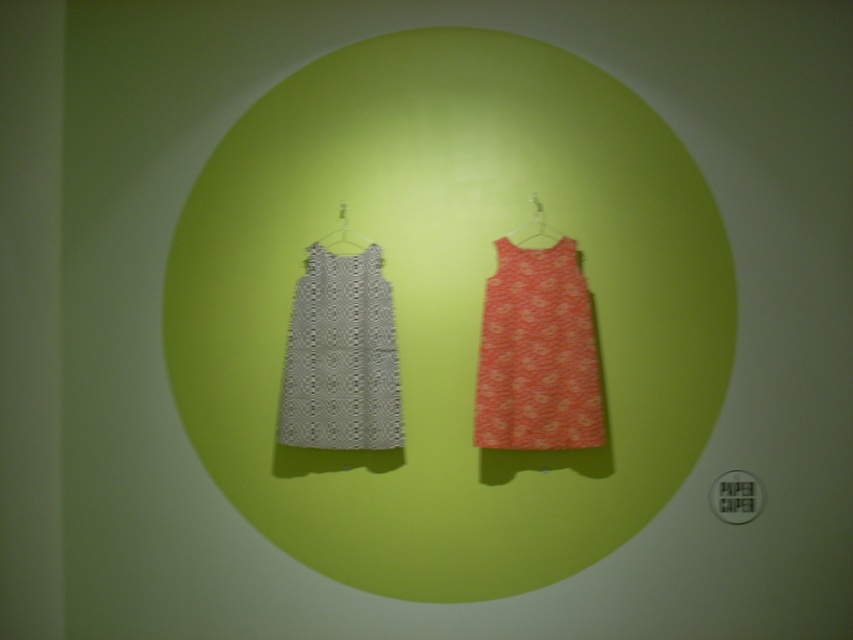
You are a fashion designer observing the image of two dresses. You need to determine which object is taller between the matte orange dress at center and the metallic silver hanger at upper center. Based on the scene, which one is taller?

The matte orange dress at center has a greater height compared to the metallic silver hanger at upper center, so the matte orange dress at center is taller.

You are standing 7 feet away from a display of dresses. You want to grab the matte orange dress at center without moving closer. Is it possible to reach it from your current position?

The matte orange dress at center is 6.95 feet away from the viewer. Since you are standing 7 feet away, you can just barely reach it without moving closer.

You are standing in front of the two dresses displayed against the green background. The point at coordinates (567, 342) is 7.03 feet away from you. If you want to reach that point, which dress should you move toward?

The point at coordinates (567, 342) is 7.03 feet away from the viewer. Since the point is equidistant to both dresses, you can move toward either the black and white geometric patterned dress on the left or the vibrant orange floral dress on the right.